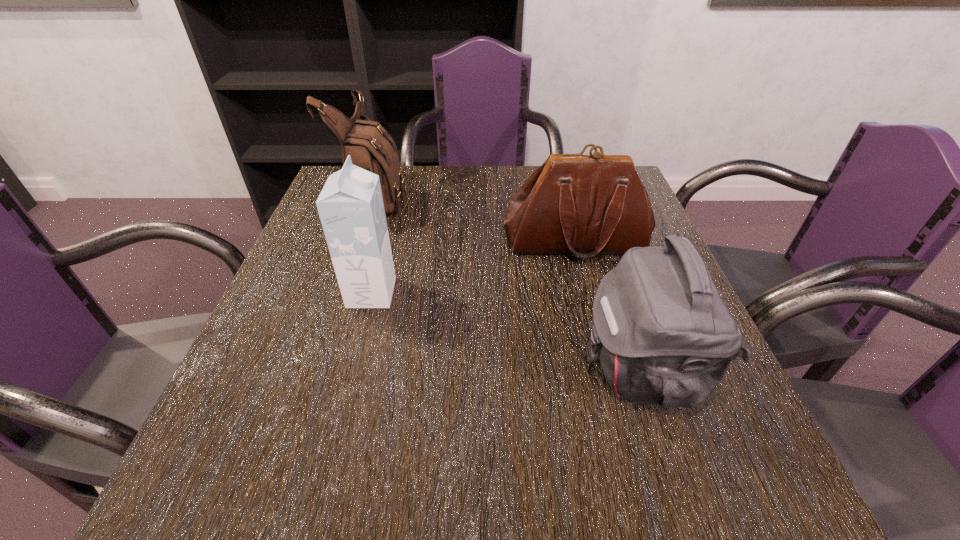
Select which object appears as the second closest to the nearest shoulder bag. Please provide its 2D coordinates. Your answer should be formatted as a tuple, i.e. [(x, y)], where the tuple contains the x and y coordinates of a point satisfying the conditions above.

[(350, 206)]

Select which object appears as the closest to the tallest shoulder bag. Please provide its 2D coordinates. Your answer should be formatted as a tuple, i.e. [(x, y)], where the tuple contains the x and y coordinates of a point satisfying the conditions above.

[(350, 206)]

Locate which shoulder bag is the second closest to the carton. Please provide its 2D coordinates. Your answer should be formatted as a tuple, i.e. [(x, y)], where the tuple contains the x and y coordinates of a point satisfying the conditions above.

[(593, 204)]

Identify which shoulder bag is the closest to the nearest object. Please provide its 2D coordinates. Your answer should be formatted as a tuple, i.e. [(x, y)], where the tuple contains the x and y coordinates of a point satisfying the conditions above.

[(593, 204)]